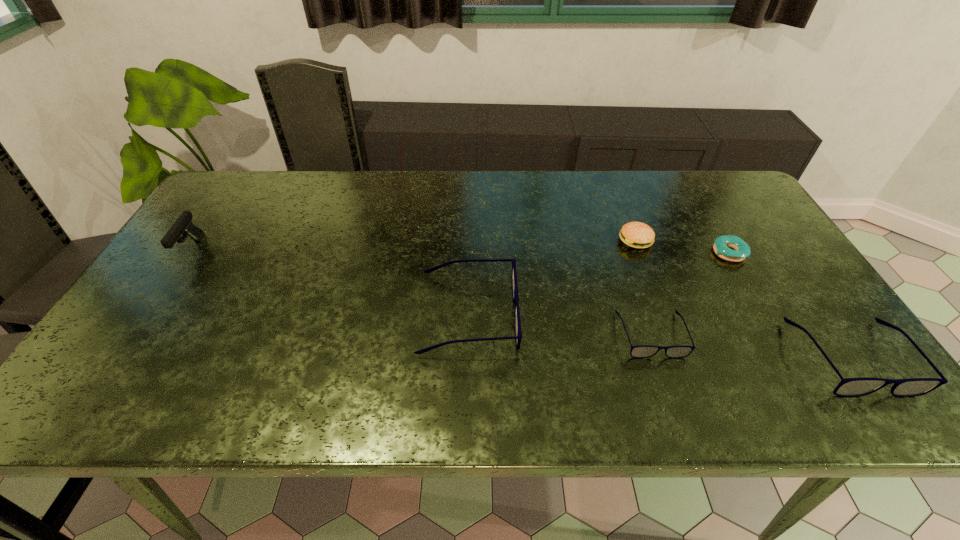
Locate an element on the screen. vacant spot to place a spectacles on the left is located at coordinates (300, 295).